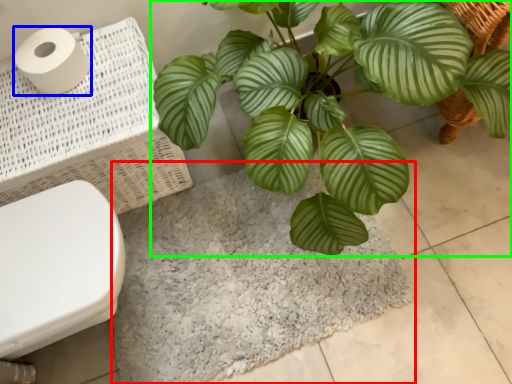
Question: Which object is the closest to the bath mat (highlighted by a red box)? Choose among these: toilet paper (highlighted by a blue box) or houseplant (highlighted by a green box).

Choices:
 (A) toilet paper
 (B) houseplant

Answer: (B)